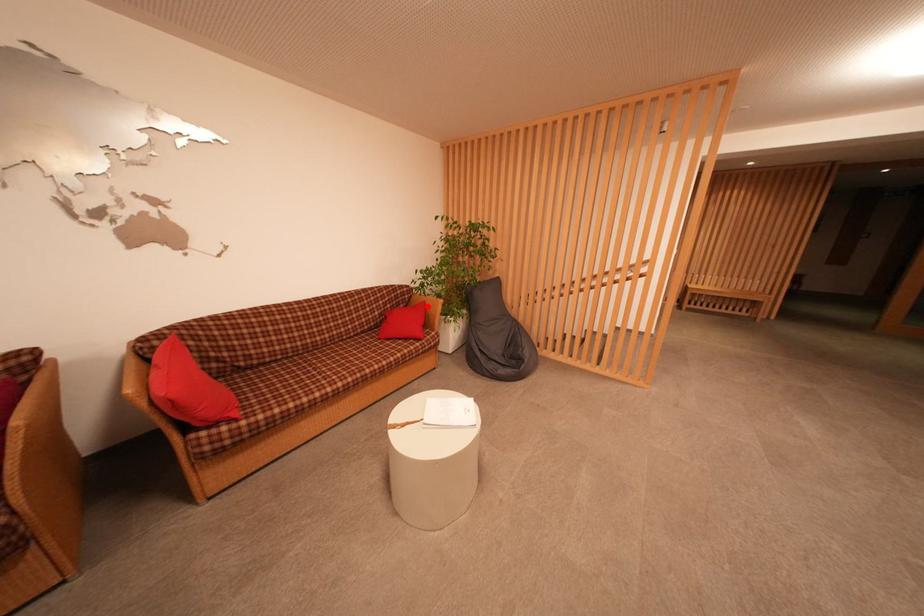
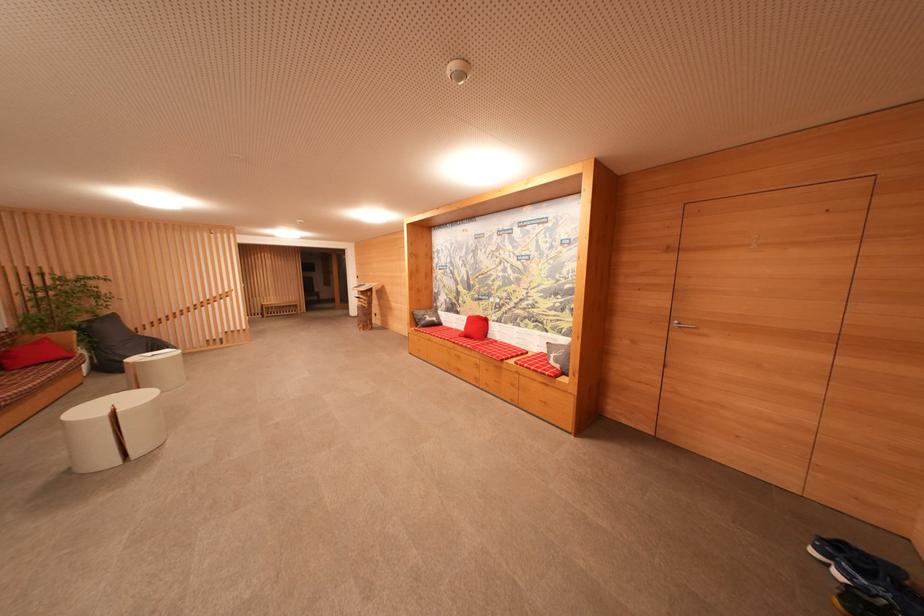
Where in the second image is the point corresponding to the highlighted location from the first image?

(50, 342)